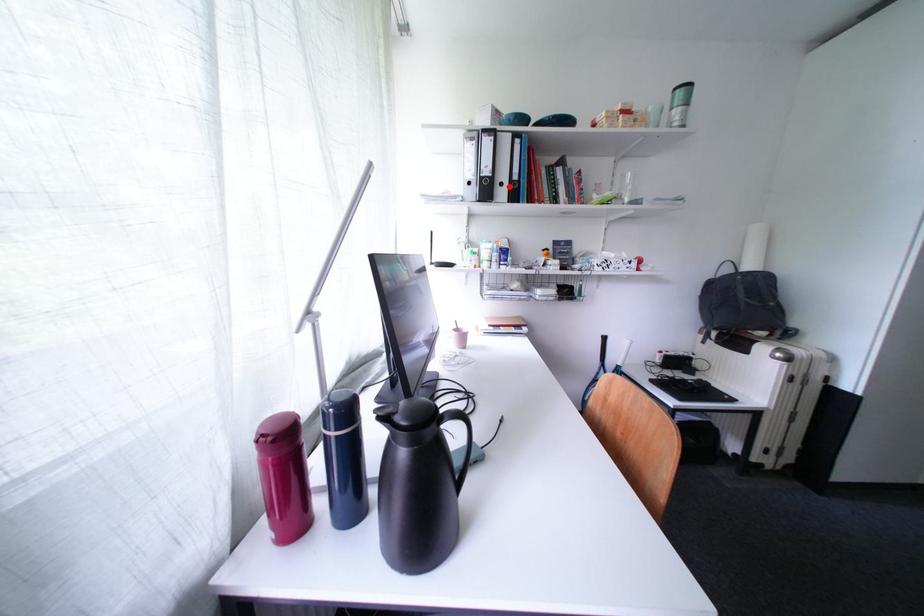
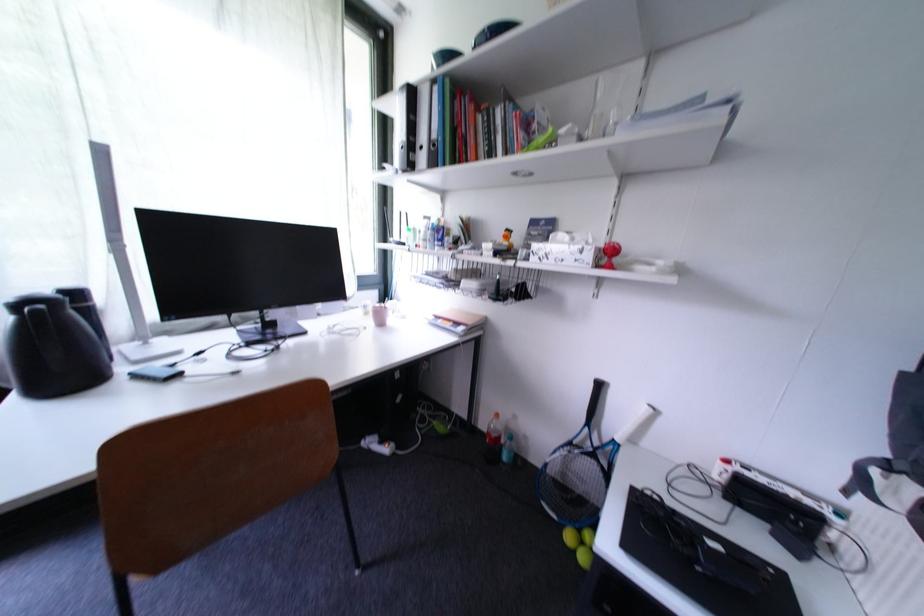
In the second image, find the point that corresponds to the highlighted location in the first image.

(430, 150)